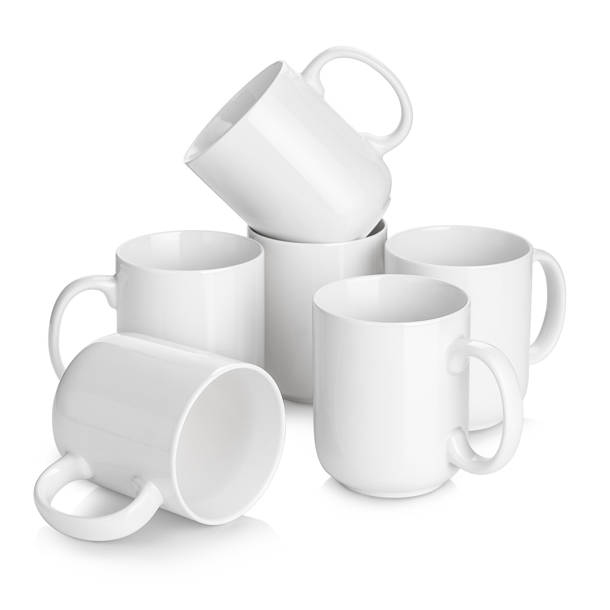
At what (x,y) coordinates should I click in order to perform the action: click on white mug. Please return your answer as a coordinate pair (x, y). The height and width of the screenshot is (610, 610). Looking at the image, I should click on (309, 171), (271, 290), (210, 296), (187, 418), (354, 404), (515, 284).